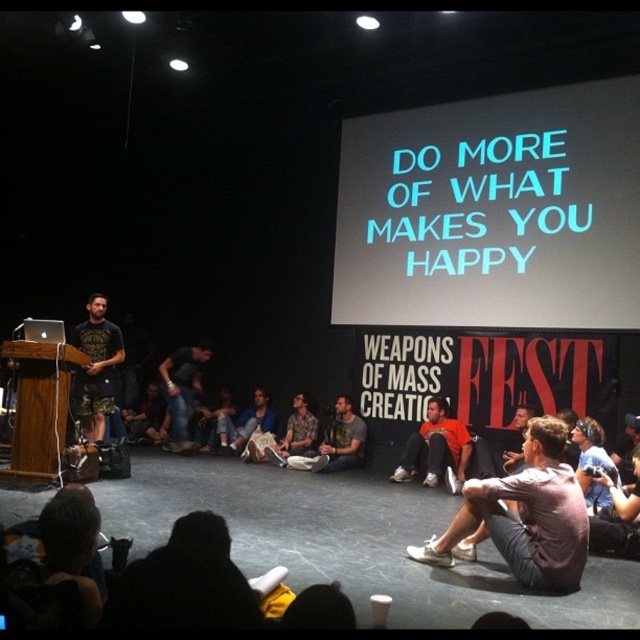
In the scene shown: Does dark green camouflage pants at left appear on the right side of orange cotton shirt at center?

Incorrect, dark green camouflage pants at left is not on the right side of orange cotton shirt at center.

Is point (100, 339) closer to camera compared to point (440, 420)?

That is True.

Is point (81, 381) positioned after point (401, 468)?

No.

This screenshot has height=640, width=640. I want to click on dark green camouflage pants at left, so click(x=96, y=368).

Is the position of jeans at center more distant than that of denim pants at center?

No, jeans at center is closer to the viewer.

Does jeans at center appear on the left side of denim pants at center?

Yes, jeans at center is to the left of denim pants at center.

Who is more forward, (x=170, y=397) or (x=248, y=435)?

Point (x=248, y=435) is in front.

The image size is (640, 640). Identify the location of jeans at center. (180, 390).

Which of these two, gray fabric shirt at center or dark green camouflage pants at left, stands shorter?

With less height is gray fabric shirt at center.

Is gray fabric shirt at center in front of dark green camouflage pants at left?

Yes, gray fabric shirt at center is in front of dark green camouflage pants at left.

Does point (506, 502) come closer to viewer compared to point (92, 433)?

Yes, point (506, 502) is closer to viewer.

At what (x,y) coordinates should I click in order to perform the action: click on gray fabric shirt at center. Please return your answer as a coordinate pair (x, y). Image resolution: width=640 pixels, height=640 pixels. Looking at the image, I should click on (522, 516).